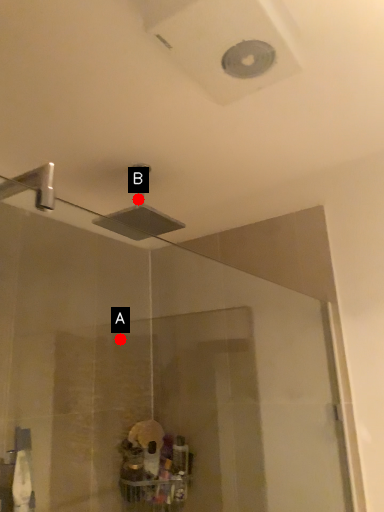
Question: Two points are circled on the image, labeled by A and B beside each circle. Among these points, which one is farthest from the camera?

Choices:
 (A) A is further
 (B) B is further

Answer: (A)